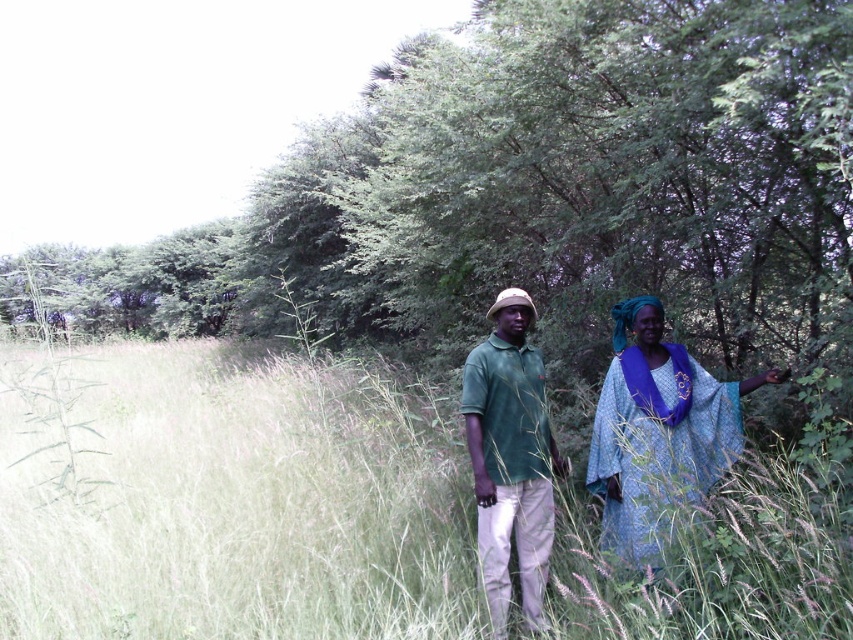
Measure the distance between green grass at center and green matte shirt at center.

3.05 meters

Which is above, green grass at center or green matte shirt at center?

Positioned higher is green matte shirt at center.

At what (x,y) coordinates should I click in order to perform the action: click on green grass at center. Please return your answer as a coordinate pair (x, y). Looking at the image, I should click on 242,508.

Can you confirm if green grass at center is positioned to the right of blue fabric at right?

In fact, green grass at center is to the left of blue fabric at right.

Does green grass at center lie behind blue fabric at right?

No, green grass at center is in front of blue fabric at right.

This screenshot has width=853, height=640. Find the location of `green grass at center`. green grass at center is located at coordinates (242, 508).

Between blue fabric at right and green matte shirt at center, which one has less height?

With less height is blue fabric at right.

Is blue fabric at right to the right of green matte shirt at center from the viewer's perspective?

Indeed, blue fabric at right is positioned on the right side of green matte shirt at center.

The width and height of the screenshot is (853, 640). Find the location of `blue fabric at right`. blue fabric at right is located at coordinates (657, 429).

Where is `blue fabric at right`? This screenshot has height=640, width=853. blue fabric at right is located at coordinates (657, 429).